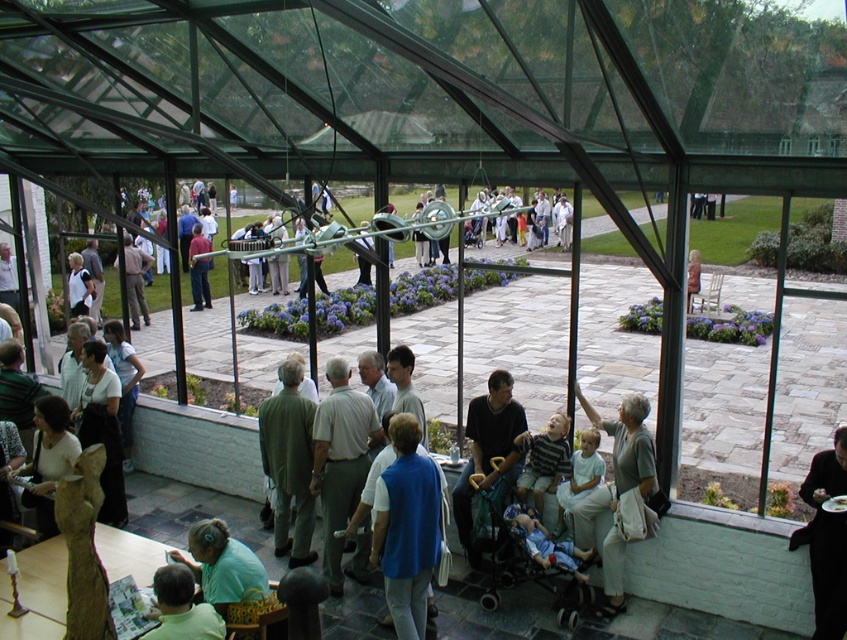
Question: Does light gray pants at lower right appear on the left side of green fabric shirt at center?

Choices:
 (A) no
 (B) yes

Answer: (A)

Question: Does blue fabric baby carriage at center have a greater width compared to matte gray pants at center?

Choices:
 (A) no
 (B) yes

Answer: (A)

Question: Which object is farther from the camera taking this photo?

Choices:
 (A) blue fabric baby carriage at center
 (B) black fabric at lower right
 (C) light blue fabric at lower center

Answer: (A)

Question: Which point is closer to the camera taking this photo?

Choices:
 (A) (650, 436)
 (B) (821, 556)

Answer: (B)

Question: Is blue fabric vest at center further to the viewer compared to dark gray fabric stroller at center?

Choices:
 (A) no
 (B) yes

Answer: (A)

Question: Which object is the farthest from the light gray shirt at center?

Choices:
 (A) light blue fabric at lower center
 (B) dark gray fabric stroller at center

Answer: (A)